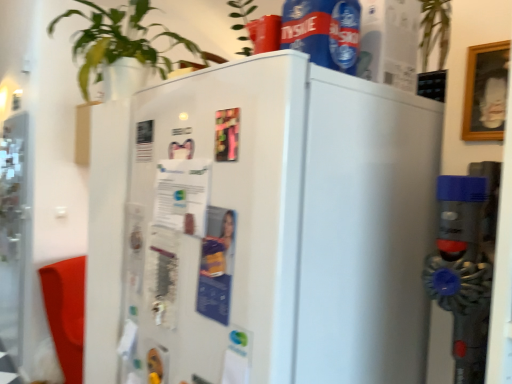
Question: Does white glossy refrigerator at center have a greater height compared to green leafy plant at upper left?

Choices:
 (A) no
 (B) yes

Answer: (B)

Question: From a real-world perspective, is white glossy refrigerator at center positioned over green leafy plant at upper left based on gravity?

Choices:
 (A) no
 (B) yes

Answer: (A)

Question: Is white glossy refrigerator at center positioned in front of green leafy plant at upper left?

Choices:
 (A) yes
 (B) no

Answer: (A)

Question: Considering the relative sizes of white glossy refrigerator at center and green leafy plant at upper left in the image provided, is white glossy refrigerator at center wider than green leafy plant at upper left?

Choices:
 (A) yes
 (B) no

Answer: (A)

Question: Can you see white glossy refrigerator at center touching green leafy plant at upper left?

Choices:
 (A) no
 (B) yes

Answer: (A)

Question: Is white glossy refrigerator at center inside or outside of green leafy plant at upper left?

Choices:
 (A) inside
 (B) outside

Answer: (B)

Question: In terms of width, does white glossy refrigerator at center look wider or thinner when compared to green leafy plant at upper left?

Choices:
 (A) thin
 (B) wide

Answer: (B)

Question: Based on their positions, is white glossy refrigerator at center located to the left or right of green leafy plant at upper left?

Choices:
 (A) left
 (B) right

Answer: (B)

Question: From the image's perspective, is white glossy refrigerator at center above or below green leafy plant at upper left?

Choices:
 (A) below
 (B) above

Answer: (A)

Question: From the image's perspective, relative to green leafy plant at upper left, is blue plastic bottle at upper center above or below?

Choices:
 (A) below
 (B) above

Answer: (A)

Question: Is blue plastic bottle at upper center bigger or smaller than green leafy plant at upper left?

Choices:
 (A) small
 (B) big

Answer: (A)

Question: Considering the positions of blue plastic bottle at upper center and green leafy plant at upper left in the image, is blue plastic bottle at upper center wider or thinner than green leafy plant at upper left?

Choices:
 (A) thin
 (B) wide

Answer: (A)

Question: In the image, is blue plastic bottle at upper center positioned in front of or behind green leafy plant at upper left?

Choices:
 (A) behind
 (B) front

Answer: (B)

Question: From a real-world perspective, relative to white glossy refrigerator at center, is transparent glass screen door at left vertically above or below?

Choices:
 (A) below
 (B) above

Answer: (A)

Question: Is transparent glass screen door at left bigger or smaller than white glossy refrigerator at center?

Choices:
 (A) big
 (B) small

Answer: (B)